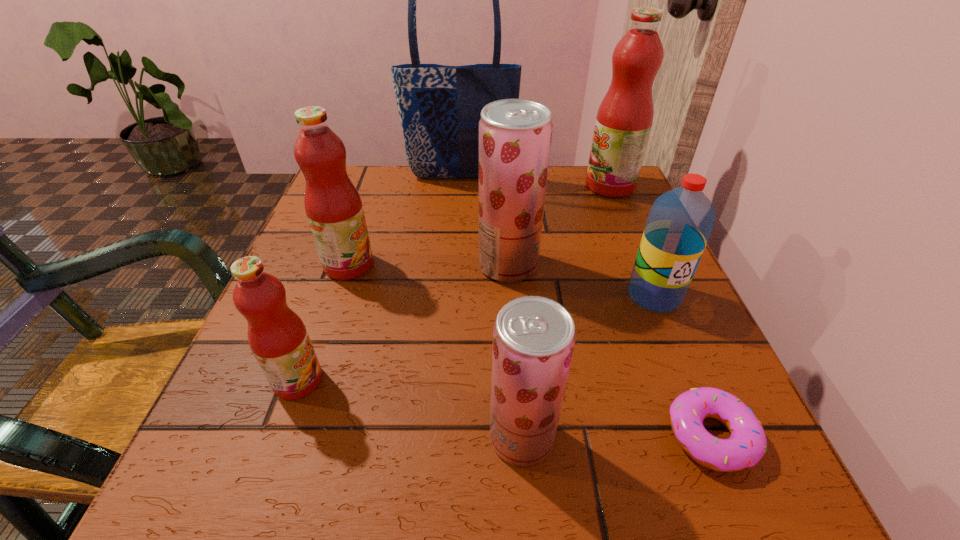
Locate an element on the screen. vacant point located between the doughnut and the water bottle is located at coordinates (683, 366).

Where is `free space between the tallest object and the second farthest pink fruit juice`? The height and width of the screenshot is (540, 960). free space between the tallest object and the second farthest pink fruit juice is located at coordinates (404, 221).

Where is `object that stands as the sixth closest to the nearest pink fruit juice`? The width and height of the screenshot is (960, 540). object that stands as the sixth closest to the nearest pink fruit juice is located at coordinates (440, 106).

Where is `object identified as the seventh closest to the tallest fruit juice`? object identified as the seventh closest to the tallest fruit juice is located at coordinates (277, 336).

You are a GUI agent. You are given a task and a screenshot of the screen. Output one action in this format:
    pyautogui.click(x=<x>, y=<y>)
    Task: Click on the fourth closest fruit juice to the bigger strawberry fruit juice
    
    Given the screenshot: What is the action you would take?
    pyautogui.click(x=277, y=336)

Identify which fruit juice is located as the third nearest to the second nearest fruit juice. Please provide its 2D coordinates. Your answer should be formatted as a tuple, i.e. [(x, y)], where the tuple contains the x and y coordinates of a point satisfying the conditions above.

[(515, 135)]

Where is `pink fruit juice that is the closest to the pink doughnut`? This screenshot has width=960, height=540. pink fruit juice that is the closest to the pink doughnut is located at coordinates (277, 336).

Image resolution: width=960 pixels, height=540 pixels. What are the coordinates of `the second closest pink fruit juice to the farthest fruit juice` in the screenshot? It's located at (277, 336).

This screenshot has width=960, height=540. I want to click on free space that satisfies the following two spatial constraints: 1. on the front-facing side of the tallest object; 2. on the front label of the second nearest pink fruit juice, so click(454, 265).

Where is `vacant space that satisfies the following two spatial constraints: 1. on the back side of the shortest object; 2. on the front label of the second nearest pink fruit juice`? This screenshot has height=540, width=960. vacant space that satisfies the following two spatial constraints: 1. on the back side of the shortest object; 2. on the front label of the second nearest pink fruit juice is located at coordinates (640, 265).